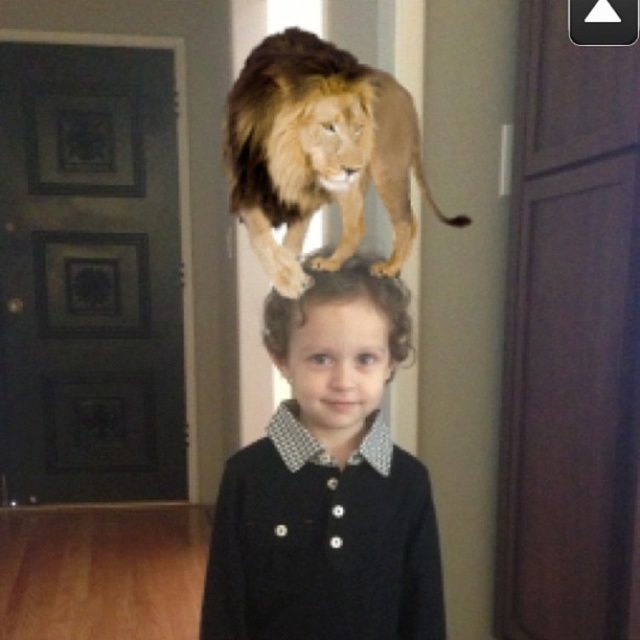
Question: Is black matte dress at center smaller than matte black hair at center?

Choices:
 (A) yes
 (B) no

Answer: (A)

Question: Which of the following is the farthest from the observer?

Choices:
 (A) (342, 356)
 (B) (326, 250)
 (C) (236, 204)

Answer: (C)

Question: Considering the real-world distances, which object is closest to the golden fur lion at center?

Choices:
 (A) matte black hair at center
 (B) black matte dress at center

Answer: (B)

Question: Can you confirm if black matte dress at center is positioned above golden fur lion at center?

Choices:
 (A) yes
 (B) no

Answer: (B)

Question: Is black matte dress at center to the right of golden fur lion at center from the viewer's perspective?

Choices:
 (A) yes
 (B) no

Answer: (B)

Question: Which object is the closest to the black matte dress at center?

Choices:
 (A) golden fur lion at center
 (B) matte black hair at center

Answer: (A)